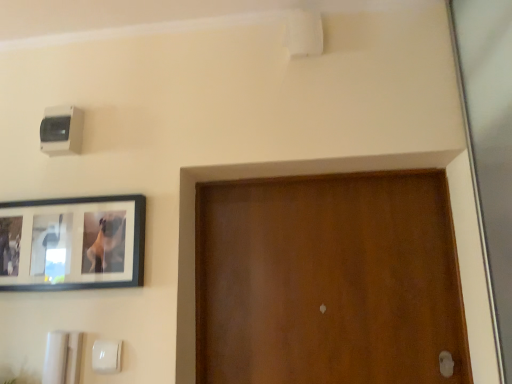
At what (x,y) coordinates should I click in order to perform the action: click on wooden-framed photo at left. Please return your answer as a coordinate pair (x, y). The height and width of the screenshot is (384, 512). Looking at the image, I should click on (72, 243).

Describe the element at coordinates (72, 243) in the screenshot. I see `wooden-framed photo at left` at that location.

The image size is (512, 384). I want to click on wooden-framed photo at left, so click(72, 243).